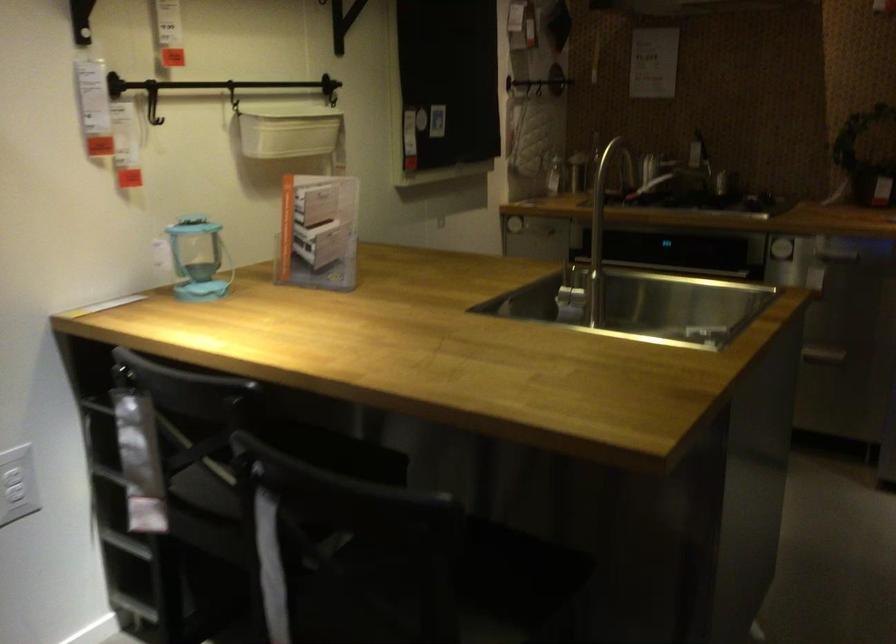
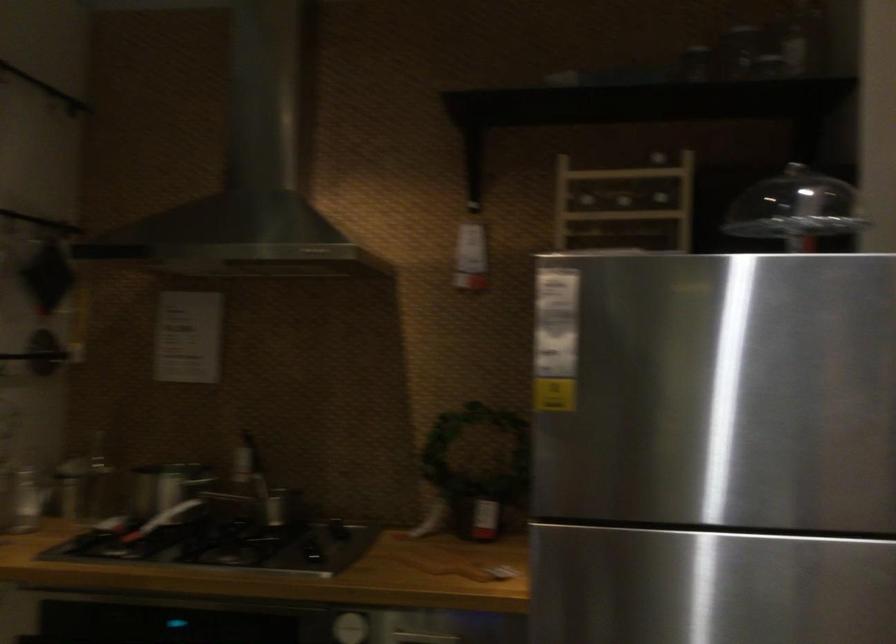
In the second image, find the point that corresponds to the point at 798,242 in the first image.

(350, 627)